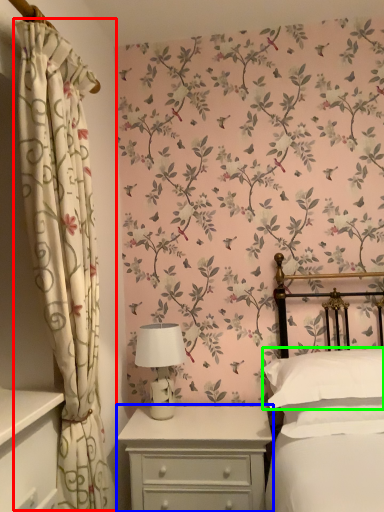
Question: Considering the real-world distances, which object is farthest from curtain (highlighted by a red box)? nightstand (highlighted by a blue box) or pillow (highlighted by a green box)?

Choices:
 (A) nightstand
 (B) pillow

Answer: (B)